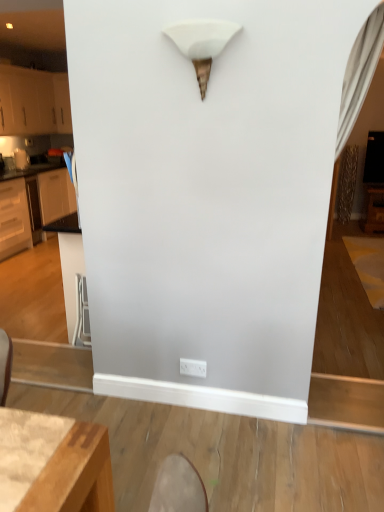
Where is `brushed metal toaster at left`? brushed metal toaster at left is located at coordinates (21, 158).

What is the approximate height of metallic silver swivel chair at lower left?

metallic silver swivel chair at lower left is 23.18 inches tall.

This screenshot has width=384, height=512. What do you see at coordinates (33, 102) in the screenshot?
I see `white matte cabinet at left, positioned as the second cabinetry in bottom-to-top order` at bounding box center [33, 102].

Find the location of a particular element. Image resolution: width=384 pixels, height=512 pixels. white glossy cabinets at left, which appears as the second cabinetry when viewed from the top is located at coordinates (32, 208).

Is white matte cabinet at left, positioned as the second cabinetry in bottom-to-top order, smaller than white matte cone at upper center?

No.

Looking at this image, does white matte cabinet at left, the 1th cabinetry viewed from the top, have a greater height compared to white matte cone at upper center?

Yes, white matte cabinet at left, the 1th cabinetry viewed from the top, is taller than white matte cone at upper center.

Would you say white matte cabinet at left, the 1th cabinetry viewed from the top, is inside or outside white matte cone at upper center?

white matte cabinet at left, the 1th cabinetry viewed from the top, lies outside white matte cone at upper center.

From the picture: Is white matte cabinet at left, the 1th cabinetry viewed from the top, turned away from white matte cone at upper center?

No.

From a real-world perspective, does white glossy cabinets at left, which appears as the 1th cabinetry when ordered from the bottom, stand above white matte cabinet at left, positioned as the second cabinetry in bottom-to-top order?

No, from a real-world perspective, white glossy cabinets at left, which appears as the 1th cabinetry when ordered from the bottom, is not over white matte cabinet at left, positioned as the second cabinetry in bottom-to-top order

Is white glossy cabinets at left, which appears as the 1th cabinetry when ordered from the bottom, oriented away from white matte cabinet at left, positioned as the second cabinetry in bottom-to-top order?

No, white matte cabinet at left, positioned as the second cabinetry in bottom-to-top order, is not at the back of white glossy cabinets at left, which appears as the 1th cabinetry when ordered from the bottom.

Is point (71, 196) positioned after point (38, 72)?

That is False.

Does point (21, 156) lie behind point (198, 362)?

Yes, it is.

Who is smaller, brushed metal toaster at left or white plastic electric outlet at lower center?

white plastic electric outlet at lower center.

In terms of width, does brushed metal toaster at left look wider or thinner when compared to white plastic electric outlet at lower center?

In the image, brushed metal toaster at left appears to be wider than white plastic electric outlet at lower center.

Consider the image. Is brushed metal toaster at left in front of or behind white plastic electric outlet at lower center in the image?

brushed metal toaster at left is behind white plastic electric outlet at lower center.

Consider the image. Is white matte cone at upper center facing towards brushed metal toaster at left?

No, white matte cone at upper center is not aimed at brushed metal toaster at left.

The width and height of the screenshot is (384, 512). Identify the location of appliance on the left of white matte cone at upper center. (21, 158).

Who is more distant, white matte cone at upper center or brushed metal toaster at left?

brushed metal toaster at left is further from the camera.

Which of these two, brushed metal toaster at left or metallic silver swivel chair at lower left, is smaller?

brushed metal toaster at left.

From the picture: In terms of width, does brushed metal toaster at left look wider or thinner when compared to metallic silver swivel chair at lower left?

Clearly, brushed metal toaster at left has more width compared to metallic silver swivel chair at lower left.

Which is behind, brushed metal toaster at left or metallic silver swivel chair at lower left?

brushed metal toaster at left is behind.

In the scene shown: Could you measure the distance between white matte cabinet at left, the 1th cabinetry viewed from the top, and white glossy cabinets at left, which appears as the 1th cabinetry when ordered from the bottom?

The distance of white matte cabinet at left, the 1th cabinetry viewed from the top, from white glossy cabinets at left, which appears as the 1th cabinetry when ordered from the bottom, is 4.46 feet.

From the image's perspective, between white matte cabinet at left, the 1th cabinetry viewed from the top, and white glossy cabinets at left, which appears as the 1th cabinetry when ordered from the bottom, which one is located above?

white matte cabinet at left, the 1th cabinetry viewed from the top.

Between white matte cabinet at left, the 1th cabinetry viewed from the top, and white glossy cabinets at left, which appears as the second cabinetry when viewed from the top, which one has smaller size?

With smaller size is white matte cabinet at left, the 1th cabinetry viewed from the top.

Find the location of a particular element. cabinetry above the white glossy cabinets at left, which appears as the second cabinetry when viewed from the top (from a real-world perspective) is located at coordinates (33, 102).

Is white plastic electric outlet at lower center next to metallic silver swivel chair at lower left?

No, white plastic electric outlet at lower center is not next to metallic silver swivel chair at lower left.

Is white plastic electric outlet at lower center positioned with its back to metallic silver swivel chair at lower left?

No, white plastic electric outlet at lower center's orientation is not away from metallic silver swivel chair at lower left.

Is white plastic electric outlet at lower center bigger or smaller than metallic silver swivel chair at lower left?

Clearly, white plastic electric outlet at lower center is smaller in size than metallic silver swivel chair at lower left.

You are a GUI agent. You are given a task and a screenshot of the screen. Output one action in this format:
    pyautogui.click(x=<x>, y=<y>)
    Task: Click on the light fixture located in front of the white matte cabinet at left, positioned as the second cabinetry in bottom-to-top order
    This screenshot has height=512, width=384.
    Given the screenshot: What is the action you would take?
    pyautogui.click(x=202, y=44)

Locate an element on the screen. cabinetry located above the white glossy cabinets at left, which appears as the 1th cabinetry when ordered from the bottom (from a real-world perspective) is located at coordinates (33, 102).

Estimate the real-world distances between objects in this image. Which object is closer to metallic silver swivel chair at lower left, white matte cone at upper center or white plastic electric outlet at lower center?

white plastic electric outlet at lower center is positioned closer to the anchor metallic silver swivel chair at lower left.

Estimate the real-world distances between objects in this image. Which object is closer to white matte cone at upper center, white glossy cabinets at left, which appears as the second cabinetry when viewed from the top, or white plastic electric outlet at lower center?

white plastic electric outlet at lower center is closer to white matte cone at upper center.

Which object lies nearer to the anchor point metallic silver swivel chair at lower left, brushed metal toaster at left or white matte cabinet at left, the 1th cabinetry viewed from the top?

Based on the image, brushed metal toaster at left appears to be nearer to metallic silver swivel chair at lower left.

Looking at the image, which one is located closer to white matte cabinet at left, the 1th cabinetry viewed from the top, white plastic electric outlet at lower center or white glossy cabinets at left, which appears as the 1th cabinetry when ordered from the bottom?

white glossy cabinets at left, which appears as the 1th cabinetry when ordered from the bottom, is positioned closer to the anchor white matte cabinet at left, the 1th cabinetry viewed from the top.

Which object lies further to the anchor point brushed metal toaster at left, white plastic electric outlet at lower center or white matte cone at upper center?

Among the two, white matte cone at upper center is located further to brushed metal toaster at left.

Considering their positions, is white glossy cabinets at left, which appears as the 1th cabinetry when ordered from the bottom, positioned further to metallic silver swivel chair at lower left than white matte cabinet at left, positioned as the second cabinetry in bottom-to-top order?

white matte cabinet at left, positioned as the second cabinetry in bottom-to-top order, is further to metallic silver swivel chair at lower left.

When comparing their distances from white matte cone at upper center, does metallic silver swivel chair at lower left or white plastic electric outlet at lower center seem closer?

Among the two, white plastic electric outlet at lower center is located nearer to white matte cone at upper center.

Estimate the real-world distances between objects in this image. Which object is closer to white matte cabinet at left, positioned as the second cabinetry in bottom-to-top order, brushed metal toaster at left or white matte cone at upper center?

Based on the image, brushed metal toaster at left appears to be nearer to white matte cabinet at left, positioned as the second cabinetry in bottom-to-top order.

Locate an element on the screen. swivel chair between white matte cone at upper center and white matte cabinet at left, positioned as the second cabinetry in bottom-to-top order, in the front-back direction is located at coordinates (81, 314).

The width and height of the screenshot is (384, 512). I want to click on cabinetry positioned between white plastic electric outlet at lower center and white matte cabinet at left, positioned as the second cabinetry in bottom-to-top order, from near to far, so click(x=32, y=208).

Locate an element on the screen. This screenshot has height=512, width=384. swivel chair between white plastic electric outlet at lower center and brushed metal toaster at left in the front-back direction is located at coordinates [81, 314].

This screenshot has width=384, height=512. Identify the location of electric outlet between white matte cone at upper center and white matte cabinet at left, positioned as the second cabinetry in bottom-to-top order, from front to back. (193, 367).